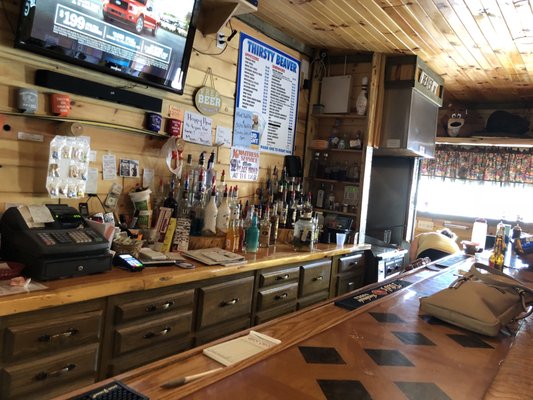
The image size is (533, 400). What are the coordinates of `cash registar` in the screenshot? It's located at (70, 262).